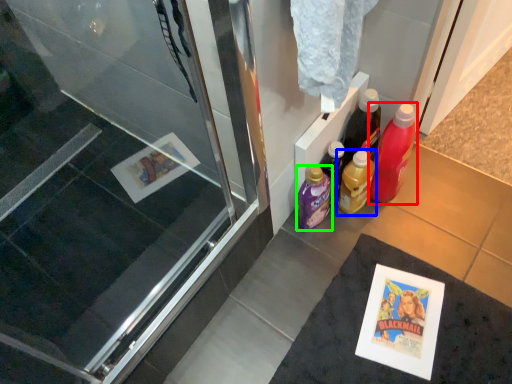
Question: Which is nearer to the bottle (highlighted by a red box)? bottle (highlighted by a blue box) or bottle (highlighted by a green box).

Choices:
 (A) bottle
 (B) bottle

Answer: (A)